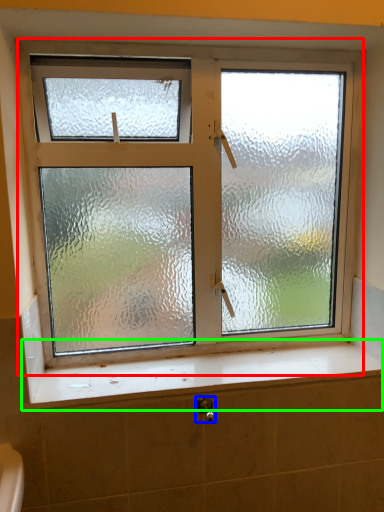
Question: Which is nearer to the window (highlighted by a red box)? shower (highlighted by a blue box) or window sill (highlighted by a green box).

Choices:
 (A) shower
 (B) window sill

Answer: (B)